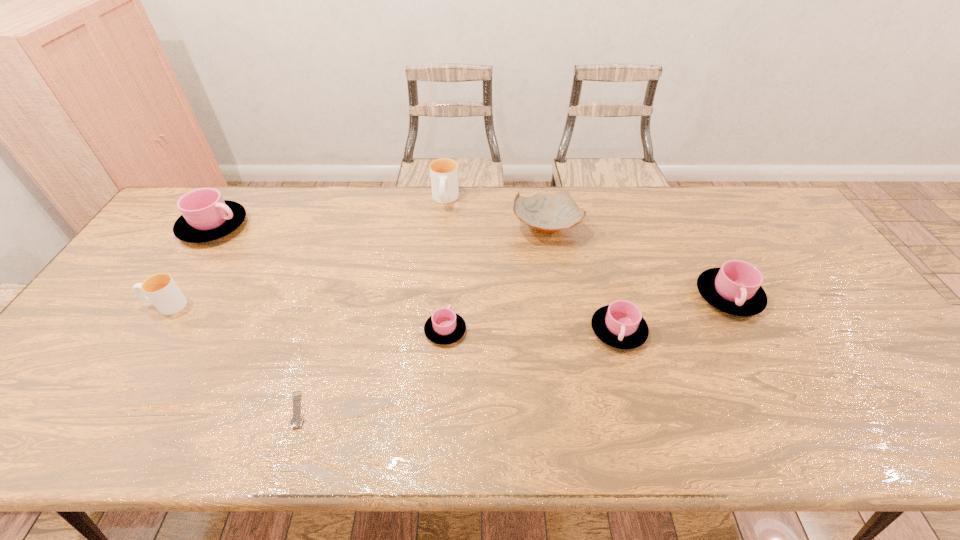
I want to click on the farther yellow cup, so click(x=444, y=172).

The image size is (960, 540). I want to click on the bigger yellow cup, so click(x=444, y=172).

Find the location of a particular element. the farthest pink cup is located at coordinates (206, 216).

Identify the location of the leftmost pink cup. The width and height of the screenshot is (960, 540). (206, 216).

The width and height of the screenshot is (960, 540). I want to click on pottery, so click(547, 213).

Find the location of a particular element. the rightmost pink cup is located at coordinates (735, 288).

Locate an element on the screen. This screenshot has width=960, height=540. the rightmost cup is located at coordinates (735, 288).

Locate an element on the screen. This screenshot has width=960, height=540. the smaller yellow cup is located at coordinates (161, 290).

This screenshot has height=540, width=960. Find the location of `the nearer yellow cup`. the nearer yellow cup is located at coordinates (161, 290).

Image resolution: width=960 pixels, height=540 pixels. Find the location of `the sixth tallest object`. the sixth tallest object is located at coordinates (620, 325).